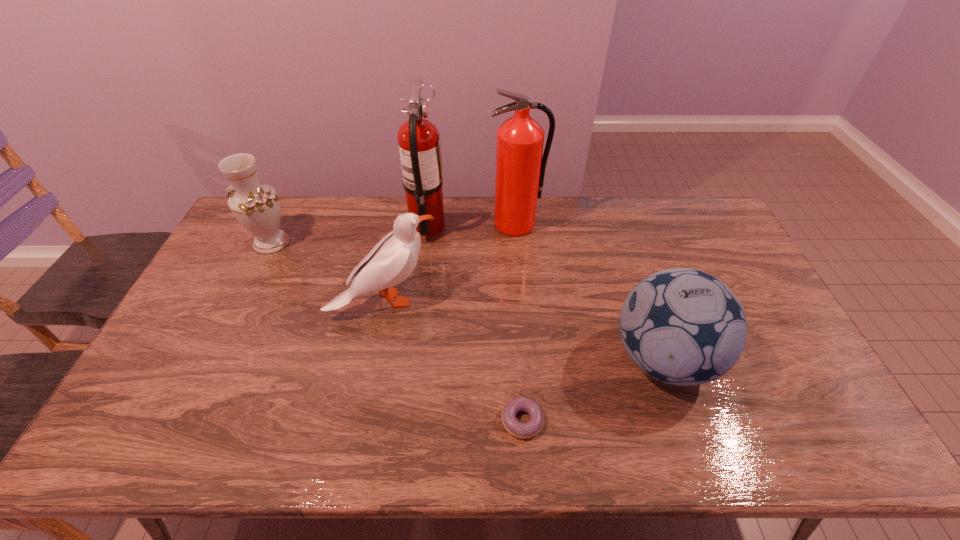
I want to click on the left fire extinguisher, so click(419, 142).

The width and height of the screenshot is (960, 540). I want to click on the right fire extinguisher, so click(520, 168).

You are a GUI agent. You are given a task and a screenshot of the screen. Output one action in this format:
    pyautogui.click(x=<x>, y=<y>)
    Task: Click on the leftmost object
    
    Given the screenshot: What is the action you would take?
    pyautogui.click(x=256, y=206)

In order to click on gull in this screenshot , I will do `click(393, 259)`.

Where is `soccer ball`? The image size is (960, 540). soccer ball is located at coordinates (681, 326).

Identify the location of the shortest object. (530, 429).

Where is `free space located on the nozzle side of the left fire extinguisher`? The height and width of the screenshot is (540, 960). free space located on the nozzle side of the left fire extinguisher is located at coordinates click(x=468, y=226).

Locate an element on the screen. The height and width of the screenshot is (540, 960). vacant space situated at the nozzle of the right fire extinguisher is located at coordinates (522, 294).

Identify the location of free spot located on the right of the vase. (397, 242).

Find the location of a particular element. This screenshot has width=960, height=540. free region located at the beak of the gull is located at coordinates (487, 300).